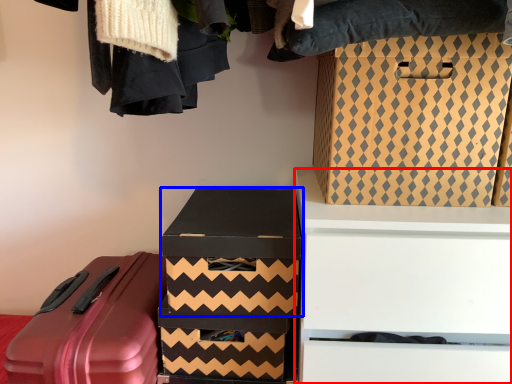
Question: Which point is further to the camera, furniture (highlighted by a red box) or box (highlighted by a blue box)?

Choices:
 (A) furniture
 (B) box

Answer: (B)